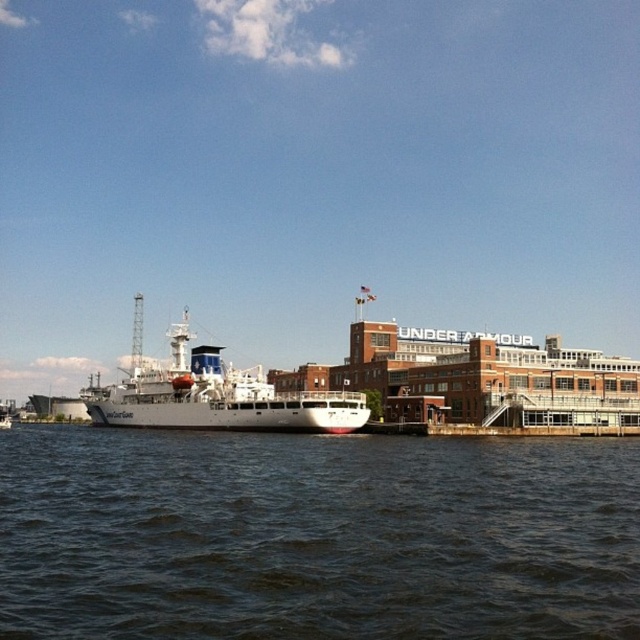
Question: Does dark blue water at lower center appear over white matte ship at center?

Choices:
 (A) no
 (B) yes

Answer: (A)

Question: Does dark blue water at lower center have a larger size compared to white matte ship at center?

Choices:
 (A) yes
 (B) no

Answer: (B)

Question: Among these objects, which one is nearest to the camera?

Choices:
 (A) white matte ship at center
 (B) dark blue water at lower center

Answer: (B)

Question: Observing the image, what is the correct spatial positioning of dark blue water at lower center in reference to white matte ship at center?

Choices:
 (A) above
 (B) below

Answer: (B)